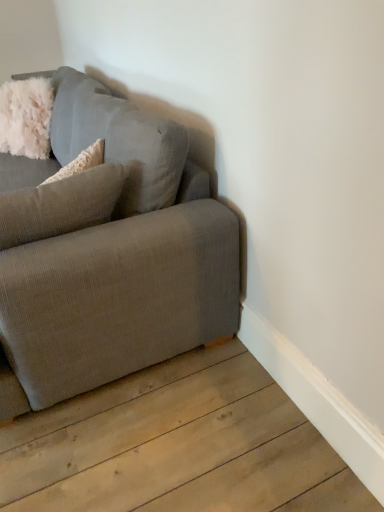
Question: Considering the positions of textured gray couch at left and fluffy white pillow at left in the image, is textured gray couch at left wider or thinner than fluffy white pillow at left?

Choices:
 (A) wide
 (B) thin

Answer: (A)

Question: From a real-world perspective, is textured gray couch at left physically located above or below fluffy white pillow at left?

Choices:
 (A) above
 (B) below

Answer: (B)

Question: From the image's perspective, relative to fluffy white pillow at left, is textured gray couch at left above or below?

Choices:
 (A) below
 (B) above

Answer: (B)

Question: From their relative heights in the image, would you say fluffy white pillow at left is taller or shorter than textured gray couch at left?

Choices:
 (A) short
 (B) tall

Answer: (A)

Question: Does point (122, 167) appear closer or farther from the camera than point (173, 301)?

Choices:
 (A) farther
 (B) closer

Answer: (B)

Question: Based on their sizes in the image, would you say fluffy white pillow at left is bigger or smaller than textured gray couch at left?

Choices:
 (A) big
 (B) small

Answer: (B)

Question: Which is correct: fluffy white pillow at left is inside textured gray couch at left, or outside of it?

Choices:
 (A) outside
 (B) inside

Answer: (B)